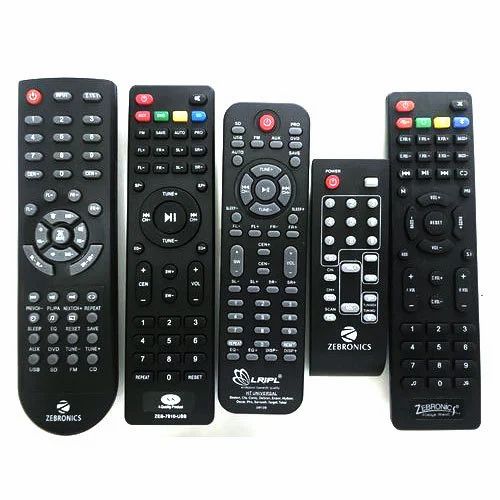
Where is `red buttons on remote`? The image size is (500, 500). red buttons on remote is located at coordinates (33, 97), (139, 97), (139, 113), (268, 116), (334, 179), (405, 102), (405, 119).